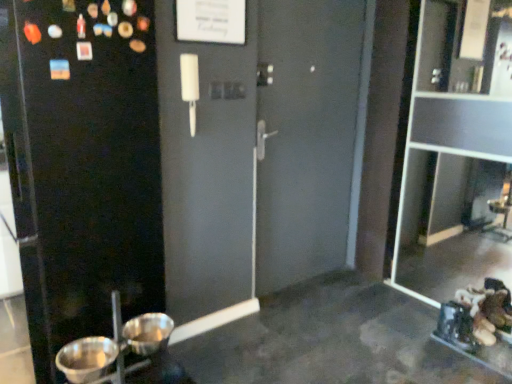
Question: From a real-world perspective, is metallic silver basin at lower left, which ranks as the first basin in right-to-left order, physically located above or below metallic silver basin at lower left, which appears as the second basin when viewed from the right?

Choices:
 (A) above
 (B) below

Answer: (B)

Question: Considering their positions, is metallic silver basin at lower left, which ranks as the first basin in right-to-left order, located in front of or behind metallic silver basin at lower left, the first basin positioned from the left?

Choices:
 (A) front
 (B) behind

Answer: (B)

Question: Estimate the real-world distances between objects in this image. Which object is farther from the black matte screen door at left?

Choices:
 (A) metallic silver basin at lower left, the second basin from the left
 (B) transparent glass cabinet at right
 (C) metallic silver basin at lower left, which appears as the second basin when viewed from the right

Answer: (B)

Question: Considering the real-world distances, which object is farthest from the transparent glass cabinet at right?

Choices:
 (A) metallic silver basin at lower left, the first basin positioned from the left
 (B) black matte screen door at left
 (C) metallic silver basin at lower left, the second basin from the left

Answer: (A)